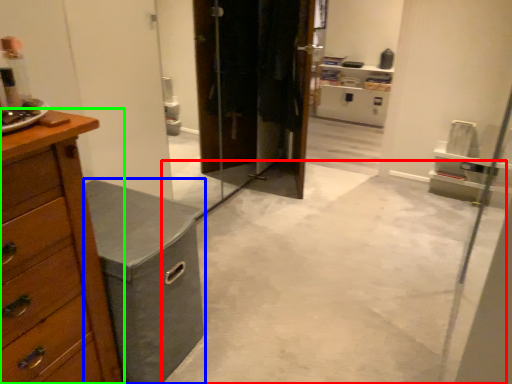
Question: Which object is positioned closest to concrete (highlighted by a red box)? Select from vanity (highlighted by a blue box) and chest of drawers (highlighted by a green box).

Choices:
 (A) vanity
 (B) chest of drawers

Answer: (A)